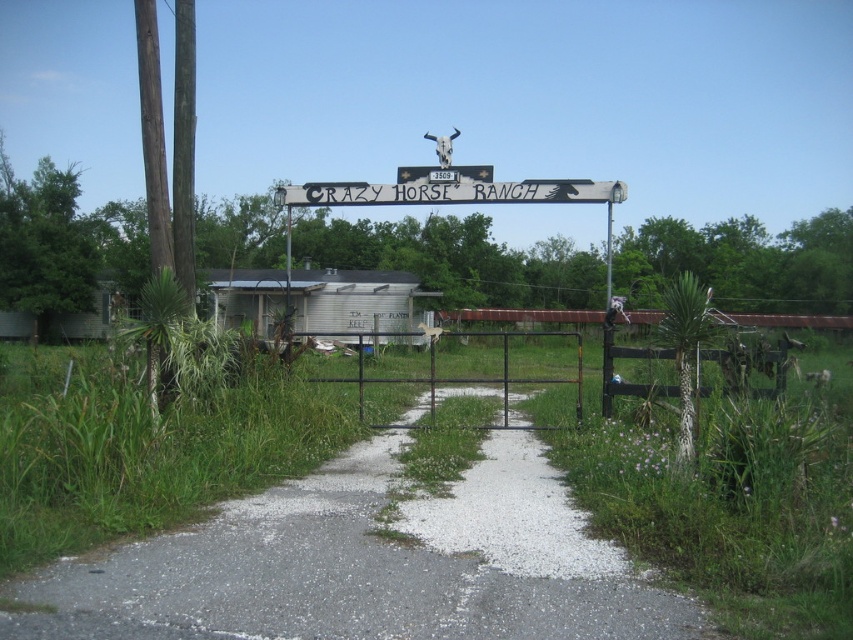
Can you confirm if brown wooden fence at right is thinner than wooden signpost at center?

Yes.

Is brown wooden fence at right behind wooden signpost at center?

No, it is not.

Is point (610, 358) less distant than point (607, 278)?

Yes, point (610, 358) is closer to viewer.

The width and height of the screenshot is (853, 640). I want to click on brown wooden fence at right, so click(630, 381).

Can you confirm if white painted wood sign at center is positioned to the left of brown wooden fence at right?

Indeed, white painted wood sign at center is positioned on the left side of brown wooden fence at right.

Who is lower down, white painted wood sign at center or brown wooden fence at right?

brown wooden fence at right is lower down.

Where is `white painted wood sign at center`? The height and width of the screenshot is (640, 853). white painted wood sign at center is located at coordinates (451, 193).

Between gravel path at center and wooden signpost at center, which one is positioned higher?

wooden signpost at center is above.

This screenshot has width=853, height=640. What do you see at coordinates (366, 564) in the screenshot?
I see `gravel path at center` at bounding box center [366, 564].

Identify the location of gravel path at center. (366, 564).